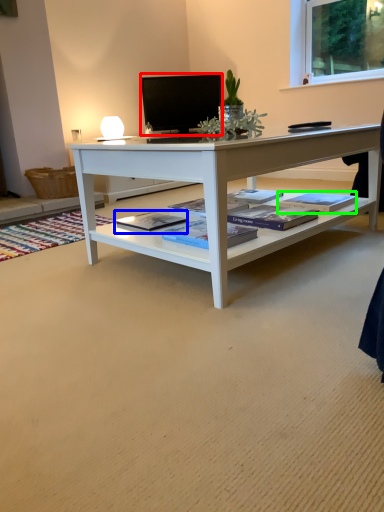
Question: Which is nearer to the television (highlighted by a red box)? book (highlighted by a blue box) or book (highlighted by a green box).

Choices:
 (A) book
 (B) book

Answer: (B)